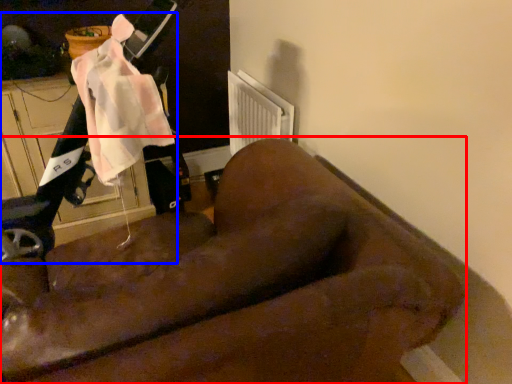
Question: Which object appears farthest to the camera in this image, furniture (highlighted by a red box) or mobility scooter (highlighted by a blue box)?

Choices:
 (A) furniture
 (B) mobility scooter

Answer: (B)